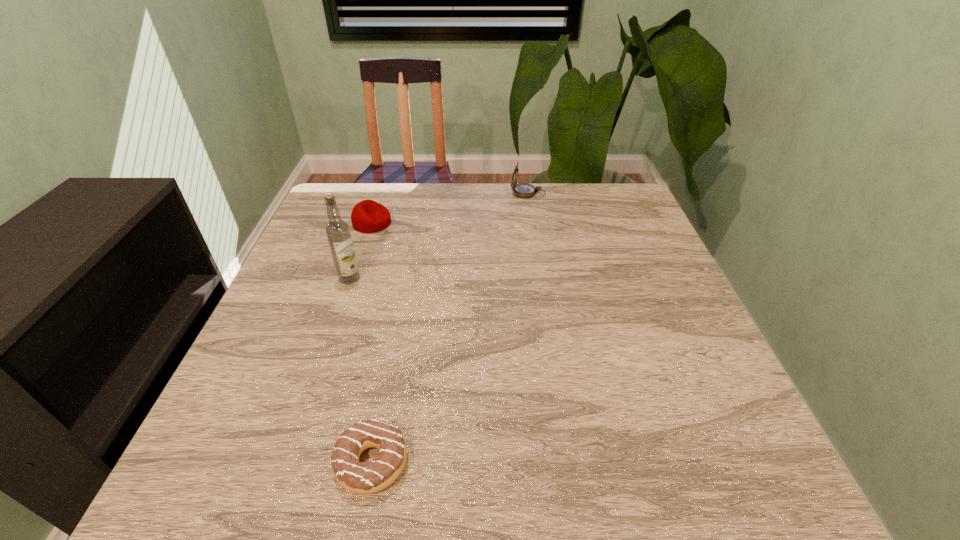
Locate an element on the screen. This screenshot has width=960, height=540. vodka is located at coordinates (337, 230).

Identify the location of the third farthest object. (337, 230).

Locate an element on the screen. The width and height of the screenshot is (960, 540). the rightmost object is located at coordinates (523, 190).

At what (x,y) coordinates should I click in order to perform the action: click on the second tallest object. Please return your answer as a coordinate pair (x, y). Looking at the image, I should click on (523, 190).

I want to click on the second shortest object, so click(368, 216).

This screenshot has height=540, width=960. I want to click on beanbag, so click(x=368, y=216).

The width and height of the screenshot is (960, 540). In order to click on the shortest object in this screenshot , I will do `click(357, 477)`.

You are a GUI agent. You are given a task and a screenshot of the screen. Output one action in this format:
    pyautogui.click(x=<x>, y=<y>)
    Task: Click on the doughnut
    The image size is (960, 540).
    Given the screenshot: What is the action you would take?
    pyautogui.click(x=357, y=477)

Where is `free point located 0.220m on the label of the third farthest object`? Image resolution: width=960 pixels, height=540 pixels. free point located 0.220m on the label of the third farthest object is located at coordinates (322, 361).

Find the location of a particular element. vacant area situated 0.390m on the face of the farthest object is located at coordinates (383, 193).